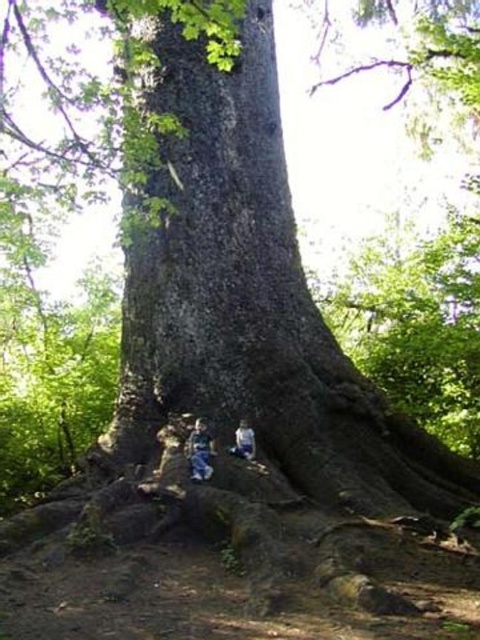
Can you confirm if green rough bark at center is smaller than blue denim jeans at lower center?

No.

What do you see at coordinates (253, 300) in the screenshot? This screenshot has height=640, width=480. I see `green rough bark at center` at bounding box center [253, 300].

Is point (240, 301) in front of point (204, 422)?

No, (240, 301) is behind (204, 422).

Where is `green rough bark at center`? The image size is (480, 640). green rough bark at center is located at coordinates (253, 300).

Measure the distance between green rough bark at center and light blue denim jeans at lower center.

green rough bark at center and light blue denim jeans at lower center are 1.34 meters apart from each other.

Does point (264, 301) lie behind point (242, 433)?

That is True.

Which is behind, point (412, 506) or point (237, 452)?

Positioned behind is point (237, 452).

Find the location of a particular element. This screenshot has height=640, width=480. green rough bark at center is located at coordinates point(253,300).

Consider the image. Does blue denim jeans at lower center have a smaller size compared to light blue denim jeans at lower center?

Actually, blue denim jeans at lower center might be larger than light blue denim jeans at lower center.

Can you confirm if blue denim jeans at lower center is positioned to the right of light blue denim jeans at lower center?

Incorrect, blue denim jeans at lower center is not on the right side of light blue denim jeans at lower center.

Measure the distance between blue denim jeans at lower center and camera.

blue denim jeans at lower center and camera are 5.05 meters apart.

The width and height of the screenshot is (480, 640). What are the coordinates of `blue denim jeans at lower center` in the screenshot? It's located at (200, 451).